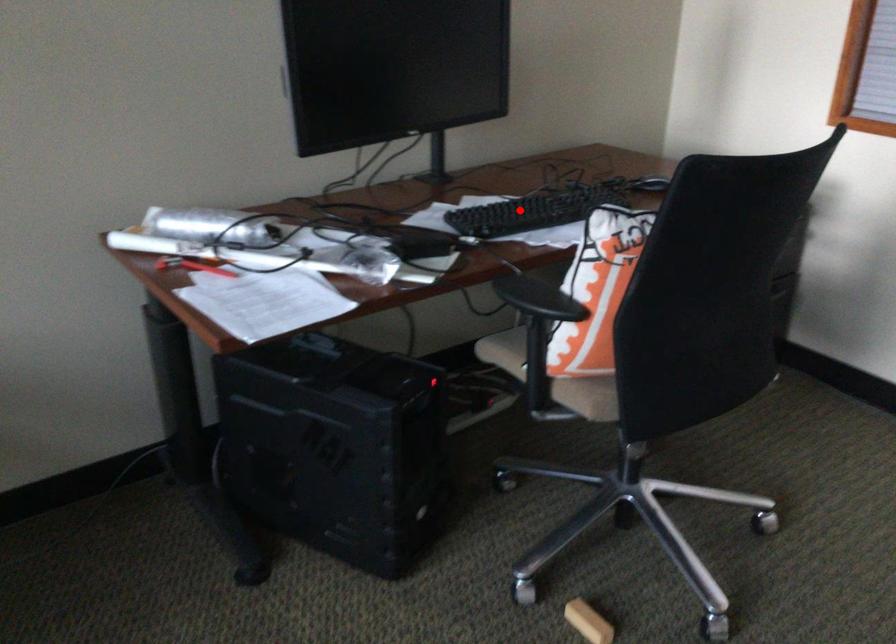
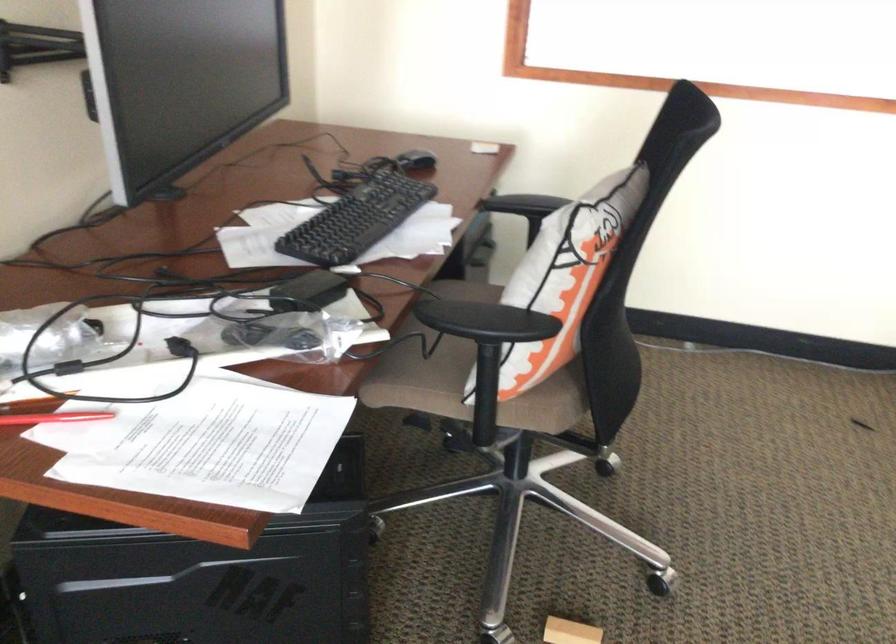
Find the pixel in the second image that matches the highlighted location in the first image.

(356, 220)